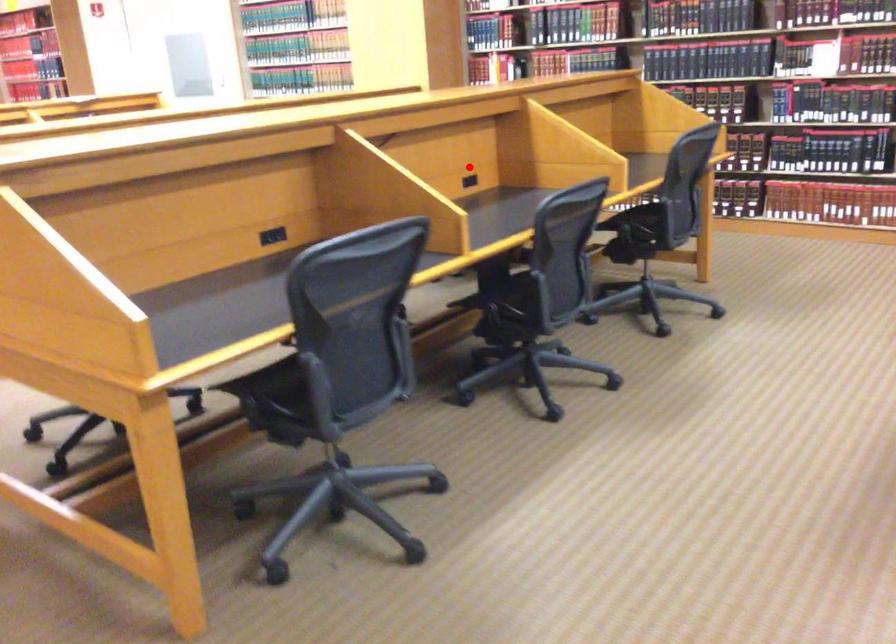
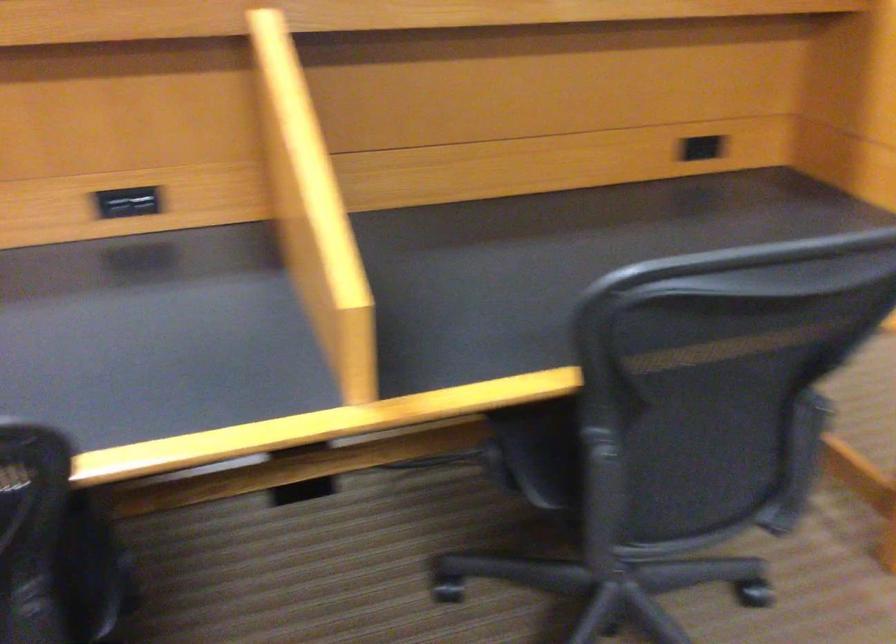
Question: I am providing you with two images of the same scene from different viewpoints. In image1, a red point is highlighted. Considering the same 3D point in image2, which of the following is correct?

Choices:
 (A) It is closer
 (B) It is farther

Answer: (A)